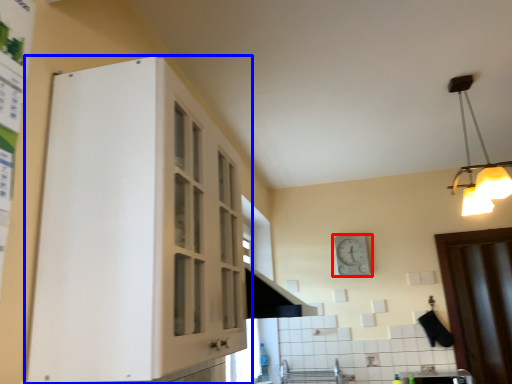
Question: Among these objects, which one is nearest to the camera, clock (highlighted by a red box) or cabinetry (highlighted by a blue box)?

Choices:
 (A) clock
 (B) cabinetry

Answer: (B)